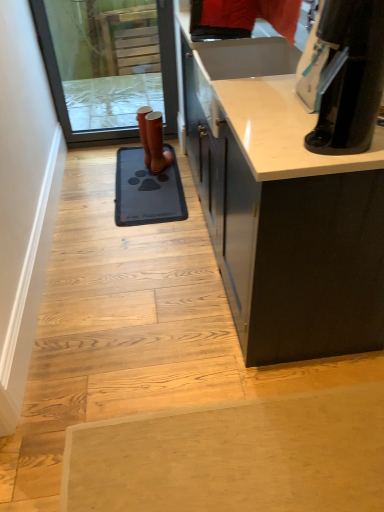
Describe the element at coordinates (349, 77) in the screenshot. I see `black glossy coffee maker at upper right` at that location.

Describe the element at coordinates (147, 190) in the screenshot. I see `blue rubber doormat at center` at that location.

Describe the element at coordinates (108, 64) in the screenshot. Image resolution: width=384 pixels, height=512 pixels. I see `transparent glass screen door at upper left` at that location.

Where is `black glossy coffee maker at upper right`? This screenshot has height=512, width=384. black glossy coffee maker at upper right is located at coordinates (349, 77).

Considering the relative sizes of transparent glass screen door at upper left and brown leather boot at center in the image provided, is transparent glass screen door at upper left taller than brown leather boot at center?

Yes.

Between transparent glass screen door at upper left and brown leather boot at center, which one has smaller size?

With smaller size is brown leather boot at center.

Do you think transparent glass screen door at upper left is within brown leather boot at center, or outside of it?

transparent glass screen door at upper left is spatially situated outside brown leather boot at center.

Identify the location of footwear that appears behind the transparent glass screen door at upper left. (156, 143).

Is transparent glass screen door at upper left closer to camera compared to blue rubber doormat at center?

No, the depth of transparent glass screen door at upper left is greater than that of blue rubber doormat at center.

Would you say transparent glass screen door at upper left is inside or outside blue rubber doormat at center?

transparent glass screen door at upper left lies outside blue rubber doormat at center.

Identify the location of screen door above the blue rubber doormat at center (from the image's perspective). (108, 64).

Which point is more distant from viewer, (153,130) or (371,94)?

The point (153,130) is farther.

Between brown leather boot at center and black glossy coffee maker at upper right, which one is positioned in front?

black glossy coffee maker at upper right is closer to the camera.

From the image's perspective, which one is positioned higher, brown leather boot at center or black glossy coffee maker at upper right?

brown leather boot at center appears higher in the image.

Is brown leather boot at center completely or partially outside of black glossy coffee maker at upper right?

Absolutely, brown leather boot at center is external to black glossy coffee maker at upper right.

From a real-world perspective, between brown leather boot at center and white smooth door at left, who is vertically higher?

From a 3D spatial view, brown leather boot at center is above.

Is brown leather boot at center oriented away from white smooth door at left?

No, brown leather boot at center is not facing the opposite direction of white smooth door at left.

Considering the sizes of objects brown leather boot at center and white smooth door at left in the image provided, who is thinner, brown leather boot at center or white smooth door at left?

Thinner between the two is white smooth door at left.

Who is shorter, brown leather boot at center or white smooth door at left?

Standing shorter between the two is white smooth door at left.

From the image's perspective, is black glossy coffee maker at upper right located above or below blue rubber doormat at center?

black glossy coffee maker at upper right is situated lower than blue rubber doormat at center in the image.

Considering the positions of objects black glossy coffee maker at upper right and blue rubber doormat at center in the image provided, who is in front, black glossy coffee maker at upper right or blue rubber doormat at center?

black glossy coffee maker at upper right is in front.

What's the angular difference between black glossy coffee maker at upper right and blue rubber doormat at center's facing directions?

The facing directions of black glossy coffee maker at upper right and blue rubber doormat at center are 88.8 degrees apart.

Considering the sizes of objects black glossy coffee maker at upper right and blue rubber doormat at center in the image provided, who is taller, black glossy coffee maker at upper right or blue rubber doormat at center?

black glossy coffee maker at upper right.

Considering the sizes of objects brown leather boot at center and blue rubber doormat at center in the image provided, who is shorter, brown leather boot at center or blue rubber doormat at center?

With less height is blue rubber doormat at center.

Is brown leather boot at center placed right next to blue rubber doormat at center?

They are not placed beside each other.

Could you tell me if brown leather boot at center is facing blue rubber doormat at center?

Yes, brown leather boot at center is turned towards blue rubber doormat at center.

Does brown leather boot at center come in front of blue rubber doormat at center?

No.

Considering the positions of objects transparent glass screen door at upper left and white smooth door at left in the image provided, who is more to the right, transparent glass screen door at upper left or white smooth door at left?

transparent glass screen door at upper left is more to the right.

Looking at this image, can you see transparent glass screen door at upper left touching white smooth door at left?

transparent glass screen door at upper left and white smooth door at left are not in contact.

Based on the photo, from a real-world perspective, is transparent glass screen door at upper left above or below white smooth door at left?

Clearly, from a real-world perspective, transparent glass screen door at upper left is above white smooth door at left.

Considering the sizes of objects transparent glass screen door at upper left and white smooth door at left in the image provided, who is shorter, transparent glass screen door at upper left or white smooth door at left?

With less height is white smooth door at left.

You are a GUI agent. You are given a task and a screenshot of the screen. Output one action in this format:
    pyautogui.click(x=<x>, y=<y>)
    Task: Click on the footwear beneath the transparent glass screen door at upper left (from a real-world perspective)
    
    Given the screenshot: What is the action you would take?
    pyautogui.click(x=156, y=143)

This screenshot has width=384, height=512. Find the location of `screen door positioned vertically above the blue rubber doormat at center (from a real-world perspective)`. screen door positioned vertically above the blue rubber doormat at center (from a real-world perspective) is located at coordinates (108, 64).

In the scene shown: From the image, which object appears to be farther from white smooth door at left, black glossy coffee maker at upper right or transparent glass screen door at upper left?

Based on the image, black glossy coffee maker at upper right appears to be further to white smooth door at left.

Looking at the image, which one is located closer to black glossy coffee maker at upper right, blue rubber doormat at center or brown leather boot at center?

blue rubber doormat at center is closer to black glossy coffee maker at upper right.

When comparing their distances from white smooth door at left, does blue rubber doormat at center or brown leather boot at center seem closer?

Based on the image, blue rubber doormat at center appears to be nearer to white smooth door at left.

Estimate the real-world distances between objects in this image. Which object is closer to blue rubber doormat at center, brown leather boot at center or black glossy coffee maker at upper right?

Based on the image, brown leather boot at center appears to be nearer to blue rubber doormat at center.

Based on their spatial positions, is white smooth door at left or transparent glass screen door at upper left closer to blue rubber doormat at center?

white smooth door at left.

Which object lies further to the anchor point black glossy coffee maker at upper right, white smooth door at left or transparent glass screen door at upper left?

The object further to black glossy coffee maker at upper right is transparent glass screen door at upper left.

Looking at the image, which one is located closer to black glossy coffee maker at upper right, brown leather boot at center or blue rubber doormat at center?

The object closer to black glossy coffee maker at upper right is blue rubber doormat at center.

When comparing their distances from white smooth door at left, does blue rubber doormat at center or black glossy coffee maker at upper right seem further?

Based on the image, black glossy coffee maker at upper right appears to be further to white smooth door at left.

You are a GUI agent. You are given a task and a screenshot of the screen. Output one action in this format:
    pyautogui.click(x=<x>, y=<y>)
    Task: Click on the doormat between black glossy coffee maker at upper right and transparent glass screen door at upper left in the front-back direction
    
    Given the screenshot: What is the action you would take?
    pyautogui.click(x=147, y=190)

I want to click on footwear between transparent glass screen door at upper left and blue rubber doormat at center from top to bottom, so click(x=156, y=143).

The width and height of the screenshot is (384, 512). Identify the location of door between black glossy coffee maker at upper right and blue rubber doormat at center in the front-back direction. (24, 198).

This screenshot has width=384, height=512. I want to click on door located between black glossy coffee maker at upper right and transparent glass screen door at upper left in the depth direction, so click(24, 198).